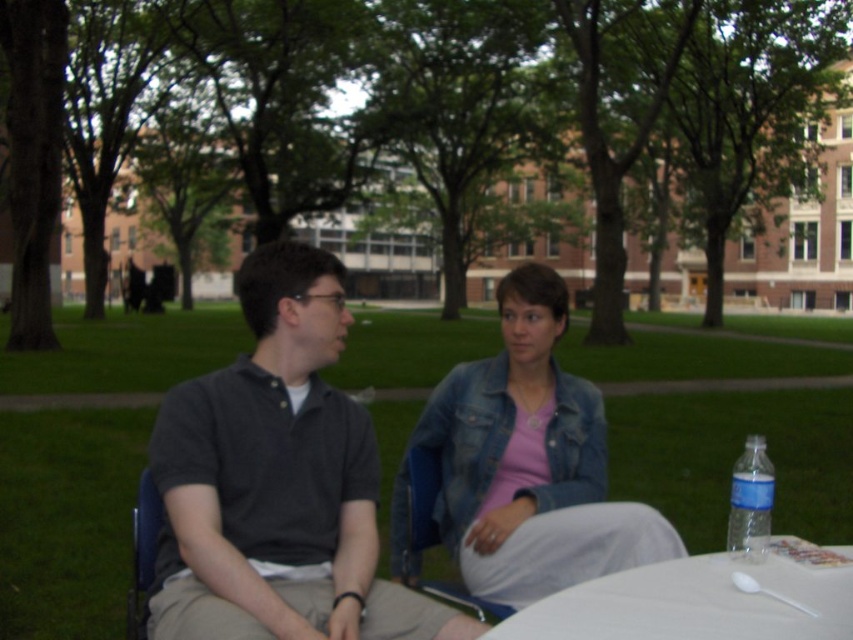
You are a fashion designer observing two people in the image. You need to determine which clothing item is visible on top between the dark gray cotton polo shirt at center and the pink denim jacket at center. Which one is on top?

The pink denim jacket at center is on top because the dark gray cotton polo shirt at center is positioned under it.

You are a photographer trying to capture both the dark gray cotton polo shirt at center and the white plastic spoon at lower right in a single frame. Which object should you focus on first to ensure both are in focus, considering their sizes?

The dark gray cotton polo shirt at center is smaller than the white plastic spoon at lower right. To ensure both are in focus, you should focus on the smaller object first, which is the dark gray cotton polo shirt at center, as it requires a closer focus point.

Based on the scene description, can you determine if the dark gray cotton polo shirt at center is resting on the blue fabric chair at lower center?

The dark gray cotton polo shirt at center is above the blue fabric chair at lower center, so it is likely resting on it.